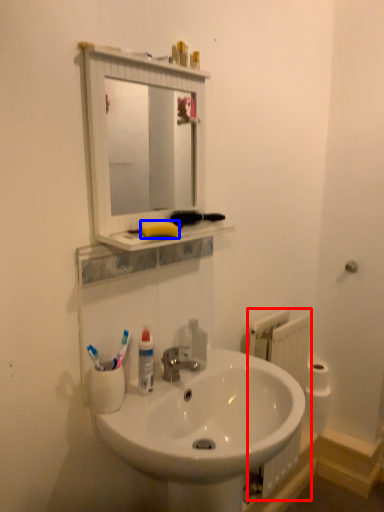
Question: Which object appears closest to the camera in this image, radiator (highlighted by a red box) or soap (highlighted by a blue box)?

Choices:
 (A) radiator
 (B) soap

Answer: (B)